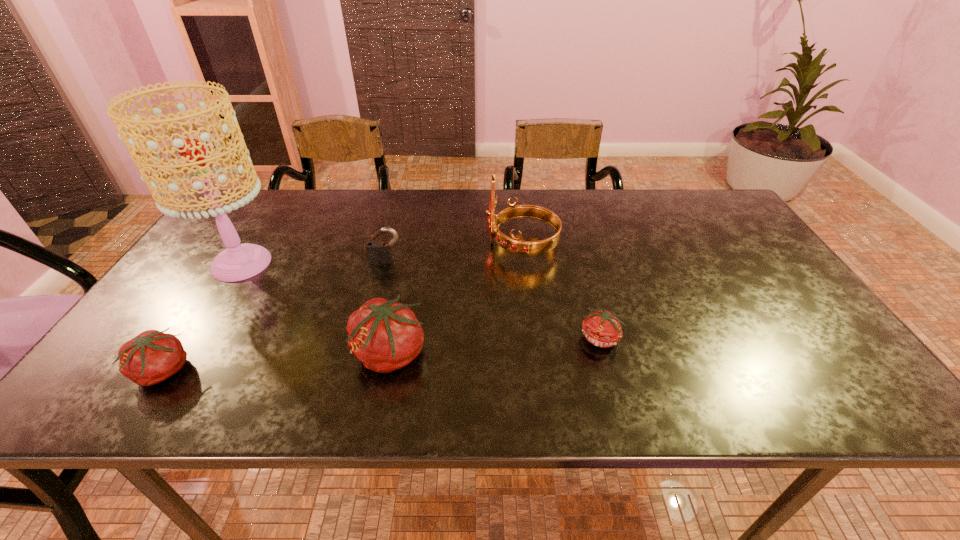
You are a GUI agent. You are given a task and a screenshot of the screen. Output one action in this format:
    pyautogui.click(x=<x>, y=<y>)
    Task: Click on the second tallest tomato
    
    Given the screenshot: What is the action you would take?
    pyautogui.click(x=151, y=357)

Locate an element on the screen. the fifth tallest object is located at coordinates 151,357.

The height and width of the screenshot is (540, 960). What are the coordinates of `the second tomato from left to right` in the screenshot? It's located at (385, 335).

Find the location of a particular element. This screenshot has height=540, width=960. the rightmost tomato is located at coordinates (601, 328).

The width and height of the screenshot is (960, 540). I want to click on the shortest tomato, so click(601, 328).

The width and height of the screenshot is (960, 540). I want to click on the fifth shortest object, so click(x=514, y=245).

Find the location of a particular element. The height and width of the screenshot is (540, 960). tiara is located at coordinates (514, 245).

The image size is (960, 540). Find the location of `the tallest object`. the tallest object is located at coordinates (238, 262).

Find the location of a particular element. The image size is (960, 540). the fourth tallest object is located at coordinates (379, 252).

You are a GUI agent. You are given a task and a screenshot of the screen. Output one action in this format:
    pyautogui.click(x=<x>, y=<y>)
    Task: Click on the vacant area situated on the right of the leftmost tomato
    
    Given the screenshot: What is the action you would take?
    pyautogui.click(x=302, y=372)